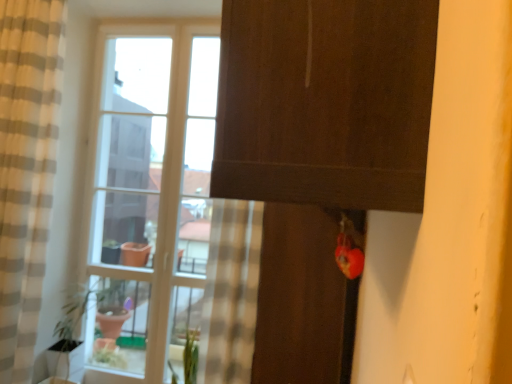
Describe the element at coordinates (26, 168) in the screenshot. The height and width of the screenshot is (384, 512). I see `beige striped curtain at left` at that location.

Locate an element on the screen. The width and height of the screenshot is (512, 384). green matte plant at lower center is located at coordinates (190, 356).

From the picture: Is beige striped curtain at left positioned behind green matte plant at lower center?

That is False.

Is beige striped curtain at left aimed at green matte plant at lower center?

No, beige striped curtain at left does not turn towards green matte plant at lower center.

From a real-world perspective, does beige striped curtain at left sit lower than green matte plant at lower center?

No.

Considering the relative positions of beige striped curtain at left and green matte plant at lower center in the image provided, is beige striped curtain at left to the left of green matte plant at lower center from the viewer's perspective?

Indeed, beige striped curtain at left is positioned on the left side of green matte plant at lower center.

Considering the positions of objects matte brown screen door at center and clear glass window at center in the image provided, who is more to the left, matte brown screen door at center or clear glass window at center?

clear glass window at center is more to the left.

From the image's perspective, is matte brown screen door at center located beneath clear glass window at center?

Correct, matte brown screen door at center appears lower than clear glass window at center in the image.

Between matte brown screen door at center and clear glass window at center, which one has larger width?

Wider between the two is matte brown screen door at center.

Which of these two, clear glass vase at lower left or matte brown screen door at center, stands shorter?

clear glass vase at lower left.

What's the angular difference between clear glass vase at lower left and matte brown screen door at center's facing directions?

They differ by 90.5 degrees in their facing directions.

Which of these two, clear glass vase at lower left or matte brown screen door at center, is smaller?

Smaller between the two is clear glass vase at lower left.

Is beige striped curtain at left surrounding matte brown screen door at center?

No, beige striped curtain at left does not contain matte brown screen door at center.

Which of these two, beige striped curtain at left or matte brown screen door at center, is wider?

matte brown screen door at center is wider.

What are the coordinates of `curtain above the matte brown screen door at center (from the image's perspective)` in the screenshot? It's located at (26, 168).

Does point (60, 60) come in front of point (329, 262)?

No, it is not.

Considering the sizes of objects clear glass vase at lower left and green matte plant at lower center in the image provided, who is bigger, clear glass vase at lower left or green matte plant at lower center?

With larger size is green matte plant at lower center.

Looking at this image, is clear glass vase at lower left at the right side of green matte plant at lower center?

Incorrect, clear glass vase at lower left is not on the right side of green matte plant at lower center.

From the image's perspective, which one is positioned lower, clear glass vase at lower left or green matte plant at lower center?

From the image's view, clear glass vase at lower left is below.

In the image, there is a green matte plant at lower center. At what (x,y) coordinates should I click in order to perform the action: click on glass vase below it (from a real-world perspective). Please return your answer as a coordinate pair (x, y). This screenshot has height=384, width=512. Looking at the image, I should click on (65, 360).

Is beige striped curtain at left smaller than clear glass window at center?

No, beige striped curtain at left is not smaller than clear glass window at center.

The width and height of the screenshot is (512, 384). I want to click on window that is below the beige striped curtain at left (from the image's perspective), so click(x=166, y=213).

From a real-world perspective, is beige striped curtain at left positioned above or below clear glass window at center?

beige striped curtain at left is above clear glass window at center.

From the image's perspective, which is above, beige striped curtain at left or clear glass window at center?

beige striped curtain at left appears higher in the image.

Does matte brown screen door at center come in front of green matte plant at lower center?

Yes, matte brown screen door at center is in front of green matte plant at lower center.

Is matte brown screen door at center to the left of green matte plant at lower center from the viewer's perspective?

No.

In the scene shown: What's the angular difference between matte brown screen door at center and green matte plant at lower center's facing directions?

The angular difference between matte brown screen door at center and green matte plant at lower center is 90.5 degrees.

Can green matte plant at lower center be found inside matte brown screen door at center?

That's incorrect, green matte plant at lower center is not inside matte brown screen door at center.

Locate an element on the screen. The width and height of the screenshot is (512, 384). curtain that appears in front of the green matte plant at lower center is located at coordinates (26, 168).

Find the location of a particular element. The height and width of the screenshot is (384, 512). screen door below the clear glass window at center (from the image's perspective) is located at coordinates (302, 300).

Looking at the image, which one is located closer to green matte plant at lower center, clear glass vase at lower left or clear glass window at center?

Among the two, clear glass vase at lower left is located nearer to green matte plant at lower center.

Looking at the image, which one is located further to clear glass vase at lower left, matte brown screen door at center or clear glass window at center?

The object further to clear glass vase at lower left is matte brown screen door at center.

From the image, which object appears to be nearer to clear glass window at center, matte brown screen door at center or beige striped curtain at left?

The object closer to clear glass window at center is beige striped curtain at left.

Considering their positions, is matte brown screen door at center positioned closer to green matte plant at lower center than clear glass vase at lower left?

The object closer to green matte plant at lower center is clear glass vase at lower left.

Which object lies nearer to the anchor point clear glass window at center, beige striped curtain at left or clear glass vase at lower left?

beige striped curtain at left lies closer to clear glass window at center than the other object.

Estimate the real-world distances between objects in this image. Which object is closer to matte brown screen door at center, clear glass vase at lower left or beige striped curtain at left?

The object closer to matte brown screen door at center is beige striped curtain at left.

Considering their positions, is matte brown screen door at center positioned closer to beige striped curtain at left than green matte plant at lower center?

green matte plant at lower center.

When comparing their distances from beige striped curtain at left, does green matte plant at lower center or matte brown screen door at center seem further?

Among the two, matte brown screen door at center is located further to beige striped curtain at left.

Identify the location of plant located between clear glass vase at lower left and matte brown screen door at center in the left-right direction. This screenshot has height=384, width=512. (190, 356).

Identify the location of window between clear glass vase at lower left and matte brown screen door at center. The width and height of the screenshot is (512, 384). (166, 213).

The height and width of the screenshot is (384, 512). I want to click on window between beige striped curtain at left and green matte plant at lower center vertically, so tap(166, 213).

At what (x,y) coordinates should I click in order to perform the action: click on plant that lies between beige striped curtain at left and clear glass vase at lower left from top to bottom. Please return your answer as a coordinate pair (x, y). This screenshot has height=384, width=512. Looking at the image, I should click on (190, 356).